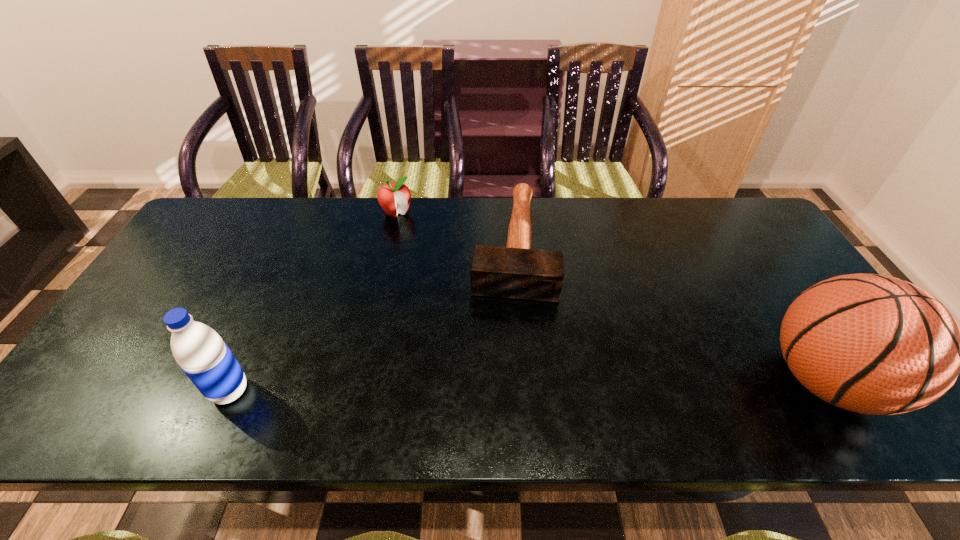
Identify the location of water bottle. This screenshot has width=960, height=540. (204, 357).

The height and width of the screenshot is (540, 960). Identify the location of the rightmost object. (873, 344).

Identify the location of mallet. (516, 271).

Identify the location of the third object from left to right. This screenshot has width=960, height=540. (516, 271).

Where is `the third tallest object`? The width and height of the screenshot is (960, 540). the third tallest object is located at coordinates (394, 197).

Locate an element on the screen. The width and height of the screenshot is (960, 540). the third object from right to left is located at coordinates (394, 197).

Find the location of a particular element. Image resolution: width=960 pixels, height=540 pixels. free spot located 0.280m on the left of the leftmost object is located at coordinates (86, 391).

Identify the location of vacant point located 0.100m on the striking face of the mallet. The image size is (960, 540). (510, 332).

The image size is (960, 540). What are the coordinates of `vacant space located 0.170m on the striking face of the mallet` in the screenshot? It's located at (508, 355).

I want to click on vacant area situated 0.050m on the striking face of the mallet, so click(511, 317).